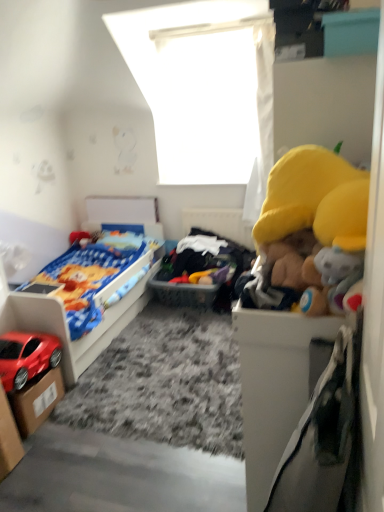
Question: Is matte plastic bed at left not close to shiny red car at lower left?

Choices:
 (A) yes
 (B) no

Answer: (B)

Question: From the image's perspective, is matte plastic bed at left on top of shiny red car at lower left?

Choices:
 (A) yes
 (B) no

Answer: (A)

Question: Does matte plastic bed at left touch shiny red car at lower left?

Choices:
 (A) yes
 (B) no

Answer: (B)

Question: Is matte plastic bed at left facing towards shiny red car at lower left?

Choices:
 (A) yes
 (B) no

Answer: (B)

Question: Does matte plastic bed at left lie in front of shiny red car at lower left?

Choices:
 (A) no
 (B) yes

Answer: (A)

Question: Can you confirm if matte plastic bed at left is thinner than shiny red car at lower left?

Choices:
 (A) no
 (B) yes

Answer: (A)

Question: Considering the relative sizes of cardboard box at lower left, the 2th storage box positioned from the front, and shiny red car at lower left in the image provided, is cardboard box at lower left, the 2th storage box positioned from the front, thinner than shiny red car at lower left?

Choices:
 (A) no
 (B) yes

Answer: (B)

Question: Is cardboard box at lower left, the 1th storage box when ordered from back to front, next to shiny red car at lower left and touching it?

Choices:
 (A) yes
 (B) no

Answer: (B)

Question: Is cardboard box at lower left, the 2th storage box positioned from the front, positioned in front of shiny red car at lower left?

Choices:
 (A) no
 (B) yes

Answer: (A)

Question: From a real-world perspective, is cardboard box at lower left, the 2th storage box positioned from the front, located higher than shiny red car at lower left?

Choices:
 (A) yes
 (B) no

Answer: (B)

Question: Considering the relative sizes of cardboard box at lower left, the 1th storage box when ordered from back to front, and shiny red car at lower left in the image provided, is cardboard box at lower left, the 1th storage box when ordered from back to front, bigger than shiny red car at lower left?

Choices:
 (A) yes
 (B) no

Answer: (B)

Question: From the image's perspective, is cardboard box at lower left, the 2th storage box positioned from the front, on top of shiny red car at lower left?

Choices:
 (A) no
 (B) yes

Answer: (A)

Question: Is shiny red car at lower left facing towards soft plush toys at center?

Choices:
 (A) yes
 (B) no

Answer: (B)